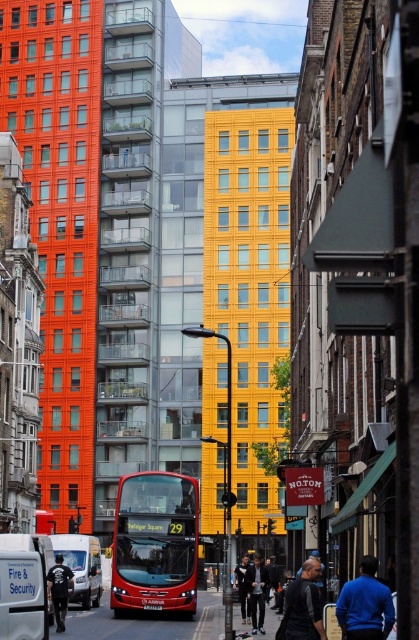
Consider the image. You are a pedestrian standing on the sidewalk near the smooth asphalt road at center and the blue sweater at lower right. Which object is closer to you?

The blue sweater at lower right is closer to you because it is positioned in front of the smooth asphalt road at center, which is further away.

Consider the image. You are a delivery driver who needs to park your white matte van at lower left on the smooth asphalt road at center. Can you safely park your van on the road without any issues related to height?

The smooth asphalt road at center has a greater height compared to white matte van at lower left, so yes, the van can be parked safely on the road as the road is higher than the van.

You are standing at point (144, 621) in the image. What is the material of the surface you are currently standing on?

The surface at point (144, 621) is smooth asphalt road at center.